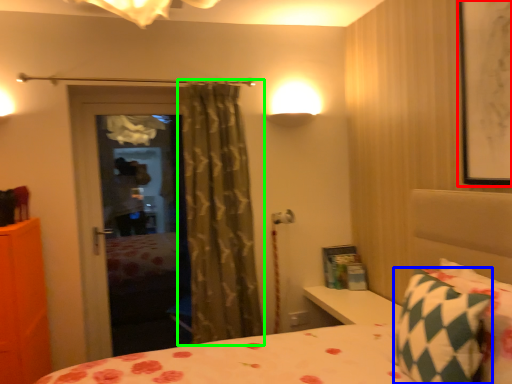
Question: Which object is the farthest from picture frame (highlighted by a red box)? Choose among these: pillow (highlighted by a blue box) or curtain (highlighted by a green box).

Choices:
 (A) pillow
 (B) curtain

Answer: (B)